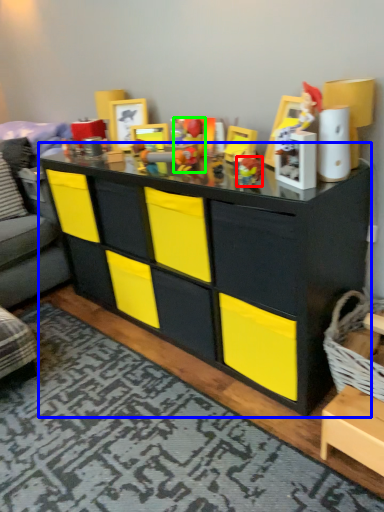
Question: Based on their relative distances, which object is nearer to toy (highlighted by a red box)? Choose from chest of drawers (highlighted by a blue box) and toy (highlighted by a green box).

Choices:
 (A) chest of drawers
 (B) toy

Answer: (B)